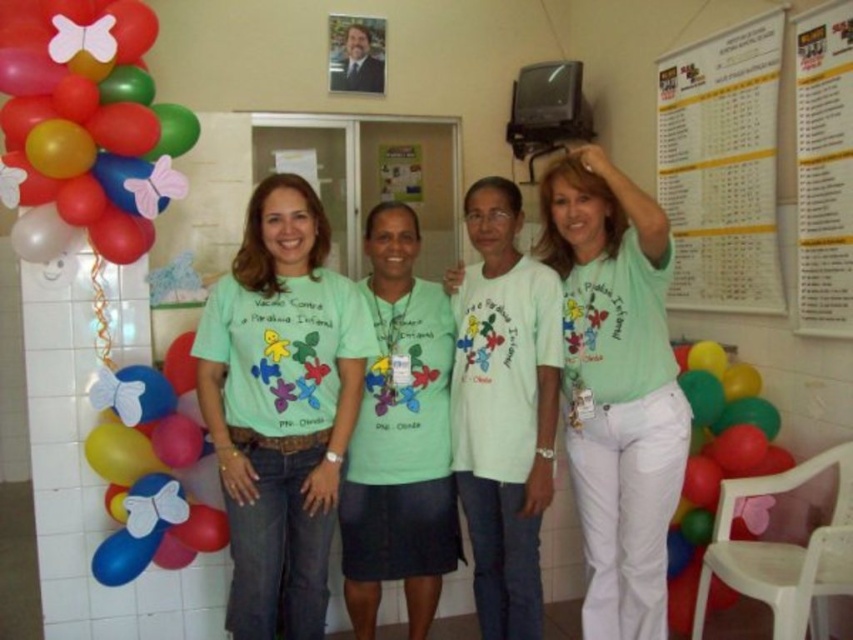
Is point (397, 240) farther from viewer compared to point (695, 353)?

No, it is not.

Which is in front, point (453, 508) or point (689, 596)?

Point (453, 508) is in front.

Identify the location of green matte shirt at center. The image size is (853, 640). (399, 436).

Identify the location of green matte shirt at center. (399, 436).

Who is more forward, (218, 445) or (752, 509)?

Point (218, 445) is more forward.

Between green matte t-shirt at center and green matte balloon at lower right, which one is positioned higher?

Positioned higher is green matte t-shirt at center.

Is point (234, 547) farther from viewer compared to point (750, 449)?

No, (234, 547) is closer to viewer.

The width and height of the screenshot is (853, 640). In order to click on green matte t-shirt at center in this screenshot , I will do `click(280, 406)`.

The width and height of the screenshot is (853, 640). Describe the element at coordinates (721, 166) in the screenshot. I see `white paper calendar at upper right` at that location.

Identify the location of white paper calendar at upper right. The width and height of the screenshot is (853, 640). (721, 166).